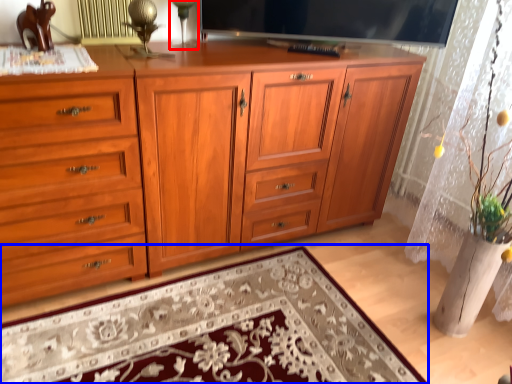
Question: Among these objects, which one is farthest to the camera, table lamp (highlighted by a red box) or mat (highlighted by a blue box)?

Choices:
 (A) table lamp
 (B) mat

Answer: (A)